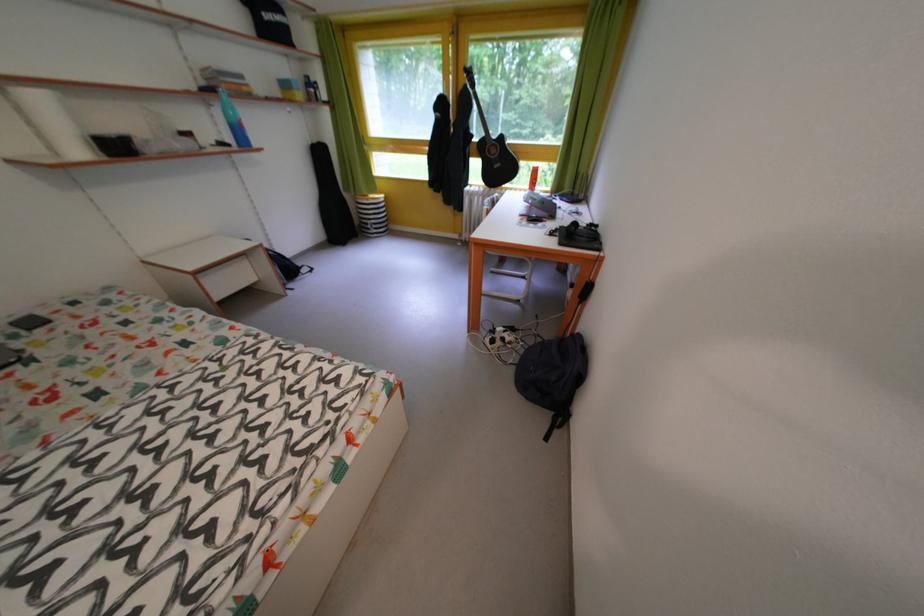
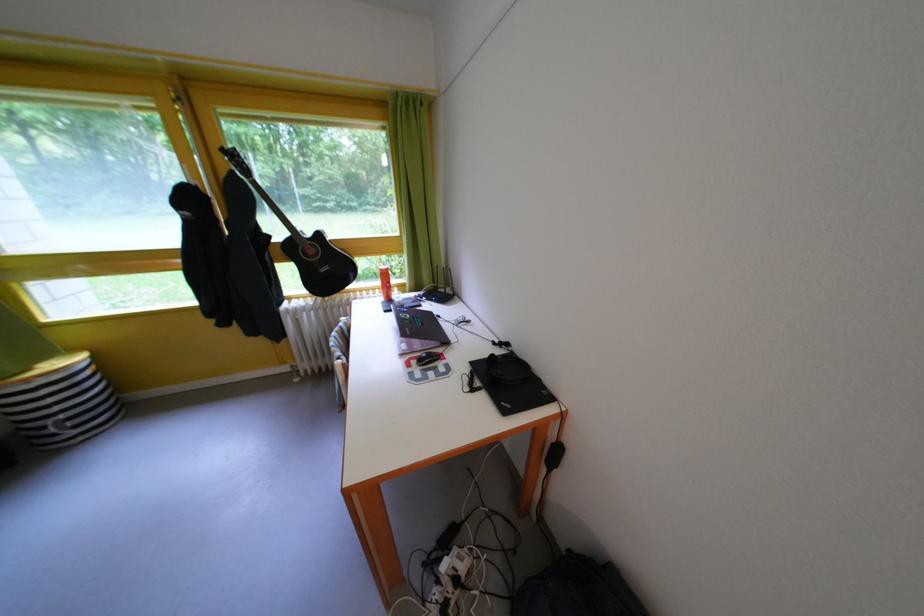
Question: The images are taken continuously from a first-person perspective. In which direction is your viewpoint rotating?

Choices:
 (A) Left
 (B) Right
 (C) Up
 (D) Down

Answer: (B)